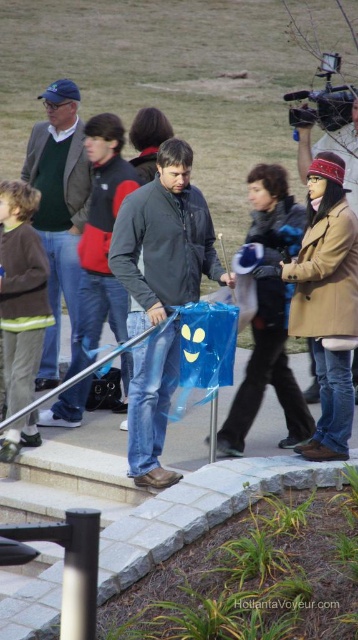
You are a photographer trying to capture a candid shot of the two people wearing the matte green sweater at upper left and the brown leather jacket at right. Since you want to ensure both subjects are in the same frame, can you determine if their positions allow for this?

The matte green sweater at upper left is located below the brown leather jacket at right, so both subjects are positioned vertically in the frame, allowing them to be captured in the same shot.

You are a photographer at the park and want to capture the matte blue plastic bag at center and the matte green sweater at upper left in the same frame. Which object will appear taller in your photo?

The matte blue plastic bag at center will appear taller in the photo since it has a greater height compared to the matte green sweater at upper left.